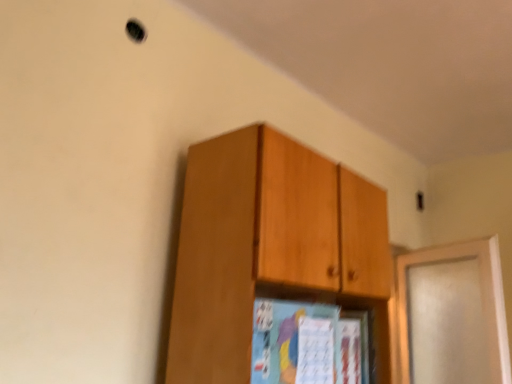
Question: From a real-world perspective, is wooden cabinet at upper center positioned under satin white door at right based on gravity?

Choices:
 (A) yes
 (B) no

Answer: (B)

Question: Is wooden cabinet at upper center facing towards satin white door at right?

Choices:
 (A) yes
 (B) no

Answer: (B)

Question: Is wooden cabinet at upper center directly adjacent to satin white door at right?

Choices:
 (A) yes
 (B) no

Answer: (B)

Question: Can you confirm if wooden cabinet at upper center is thinner than satin white door at right?

Choices:
 (A) yes
 (B) no

Answer: (B)

Question: Can you confirm if wooden cabinet at upper center is bigger than satin white door at right?

Choices:
 (A) yes
 (B) no

Answer: (A)

Question: Considering the relative positions of wooden cabinet at upper center and satin white door at right in the image provided, is wooden cabinet at upper center to the right of satin white door at right from the viewer's perspective?

Choices:
 (A) yes
 (B) no

Answer: (B)

Question: Considering the relative positions of satin white door at right and wooden cabinet at upper center in the image provided, is satin white door at right behind wooden cabinet at upper center?

Choices:
 (A) no
 (B) yes

Answer: (B)

Question: Can you confirm if satin white door at right is wider than wooden cabinet at upper center?

Choices:
 (A) yes
 (B) no

Answer: (B)

Question: From the image's perspective, is satin white door at right below wooden cabinet at upper center?

Choices:
 (A) no
 (B) yes

Answer: (B)

Question: Considering the relative positions of satin white door at right and wooden cabinet at upper center in the image provided, is satin white door at right to the left of wooden cabinet at upper center from the viewer's perspective?

Choices:
 (A) no
 (B) yes

Answer: (A)

Question: Can you see satin white door at right touching wooden cabinet at upper center?

Choices:
 (A) yes
 (B) no

Answer: (B)

Question: Is satin white door at right aimed at wooden cabinet at upper center?

Choices:
 (A) yes
 (B) no

Answer: (A)

Question: Which is correct: wooden cabinet at upper center is inside satin white door at right, or outside of it?

Choices:
 (A) outside
 (B) inside

Answer: (A)